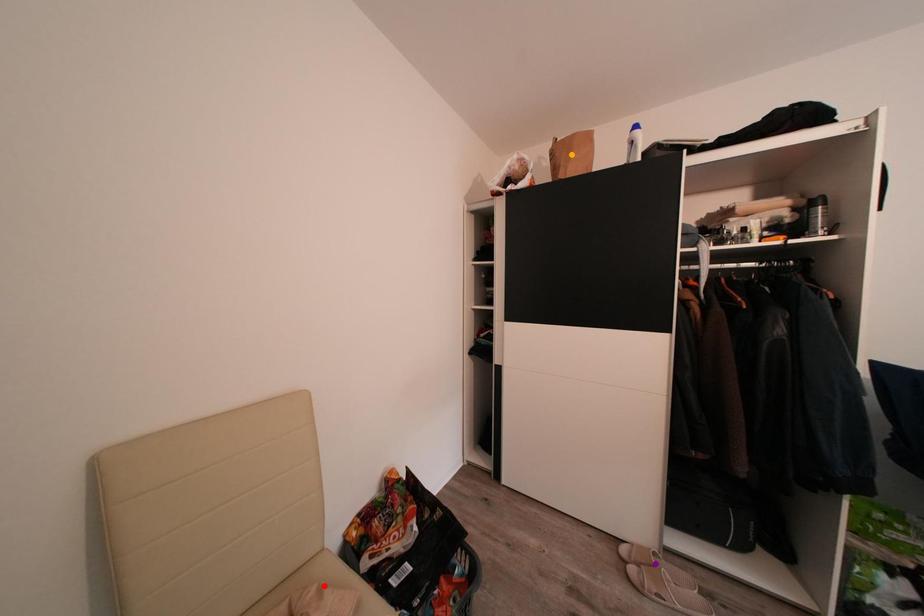
Order these from nearest to farthest:
- purple point
- orange point
- red point

red point, purple point, orange point